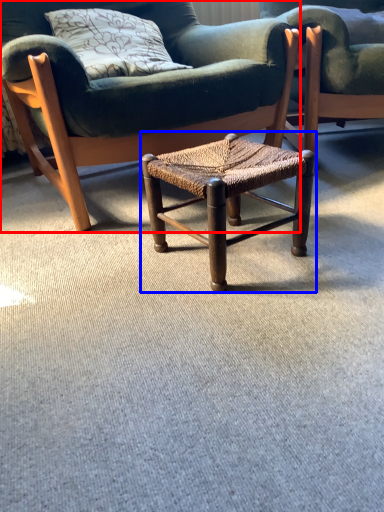
Question: Among these objects, which one is nearest to the camera, chair (highlighted by a red box) or stool (highlighted by a blue box)?

Choices:
 (A) chair
 (B) stool

Answer: (B)